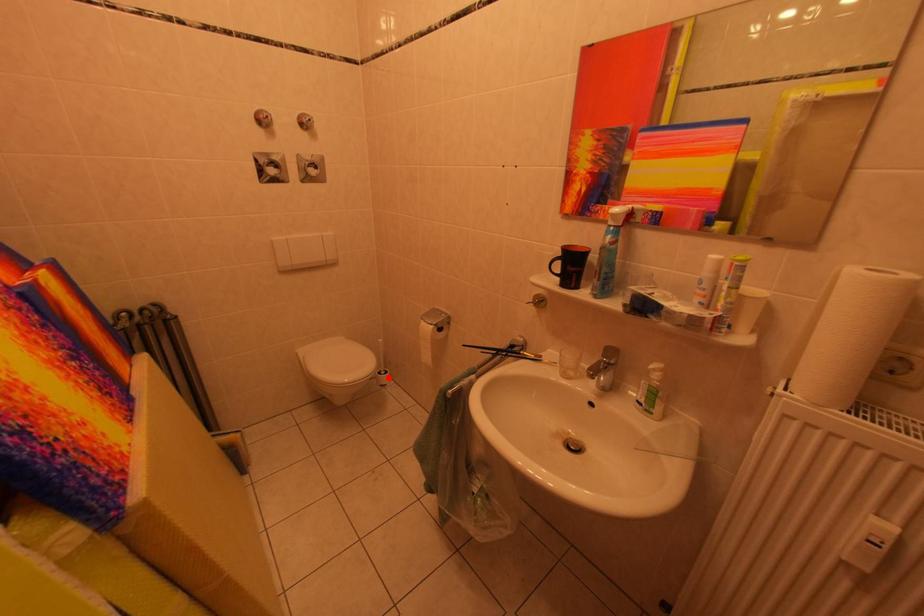
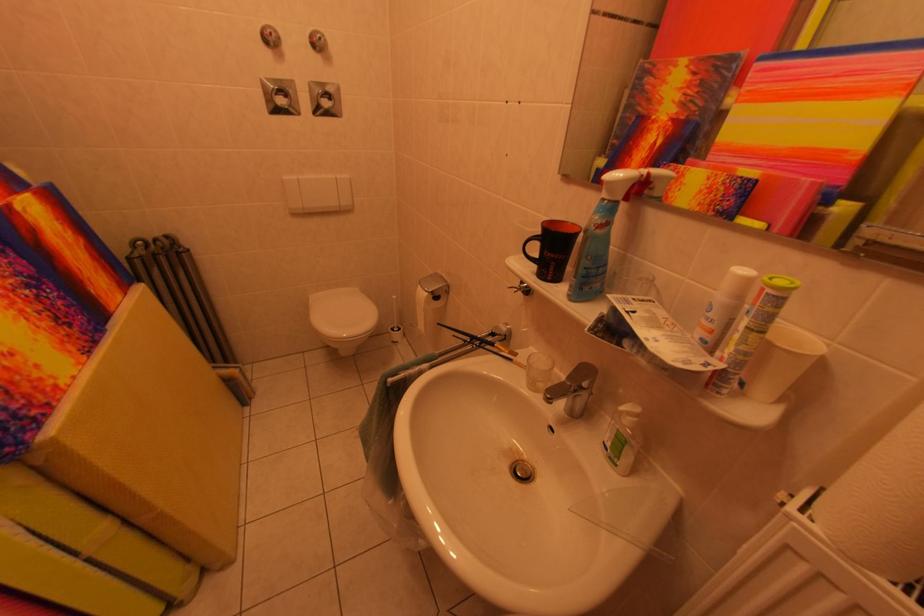
Question: I am providing you with two images of the same scene from different viewpoints. A red point is shown in image1. For the corresponding object point in image2, is it positioned nearer or farther from the camera?

Choices:
 (A) Nearer
 (B) Farther

Answer: (B)